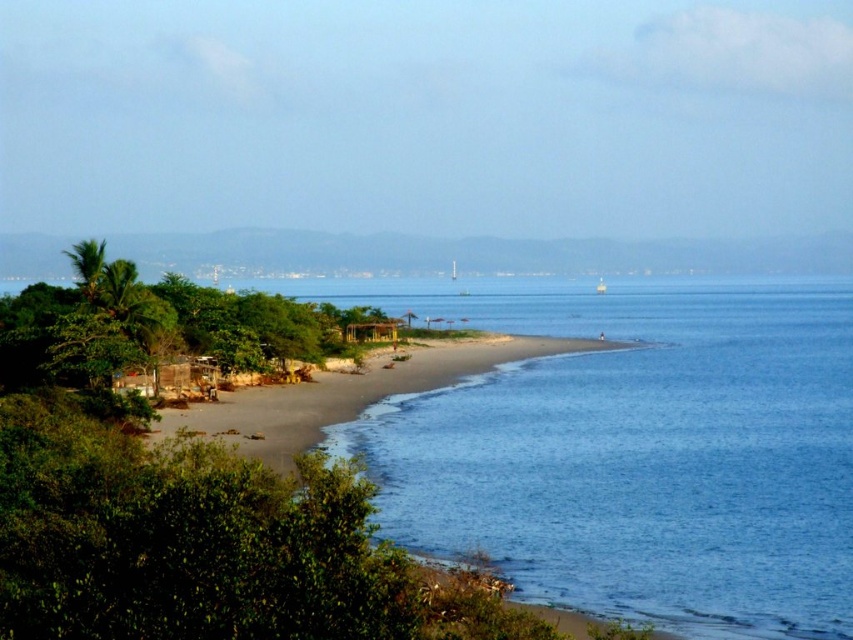
Is blue smooth water at center below brown sandy beach at lower left?

Actually, blue smooth water at center is above brown sandy beach at lower left.

Who is taller, blue smooth water at center or brown sandy beach at lower left?

With more height is blue smooth water at center.

Between point (735, 592) and point (315, 419), which one is positioned behind?

Positioned behind is point (315, 419).

Identify the location of blue smooth water at center. (633, 449).

Which is above, blue smooth water at center or white plastic boat at center?

white plastic boat at center

Which is below, blue smooth water at center or white plastic boat at center?

blue smooth water at center is below.

Identify the location of blue smooth water at center. (633, 449).

Who is positioned more to the right, brown sandy beach at lower left or white plastic boat at center?

From the viewer's perspective, white plastic boat at center appears more on the right side.

Describe the element at coordinates (351, 394) in the screenshot. This screenshot has width=853, height=640. I see `brown sandy beach at lower left` at that location.

This screenshot has width=853, height=640. What do you see at coordinates (351, 394) in the screenshot?
I see `brown sandy beach at lower left` at bounding box center [351, 394].

The image size is (853, 640). In order to click on brown sandy beach at lower left in this screenshot , I will do `click(351, 394)`.